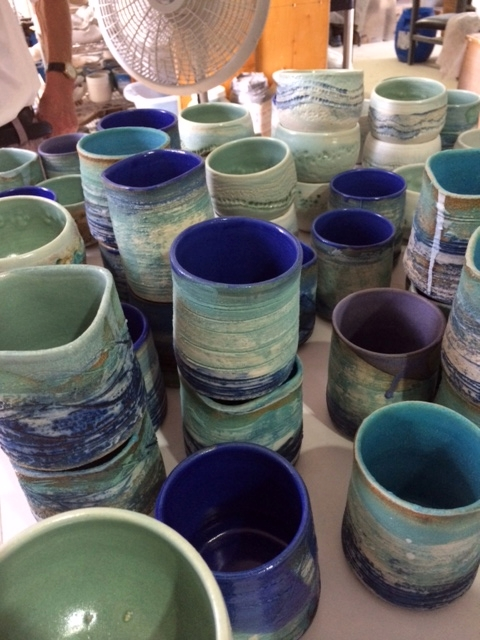
Where is `dark blue cups`? Image resolution: width=480 pixels, height=640 pixels. dark blue cups is located at coordinates (239, 476), (229, 246), (356, 221), (153, 168), (28, 189), (140, 116), (309, 256).